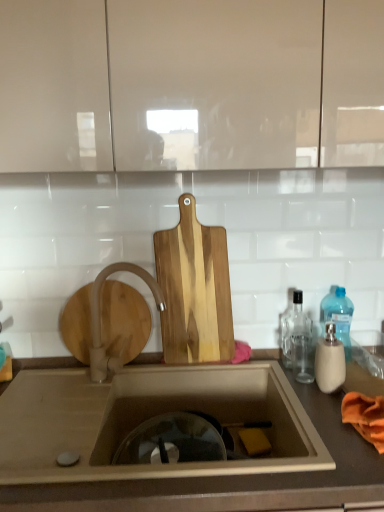
The height and width of the screenshot is (512, 384). In order to click on free space in front of transparent glass bottle at right, which ranks as the 2th bottle in back-to-front order in this screenshot , I will do `click(317, 389)`.